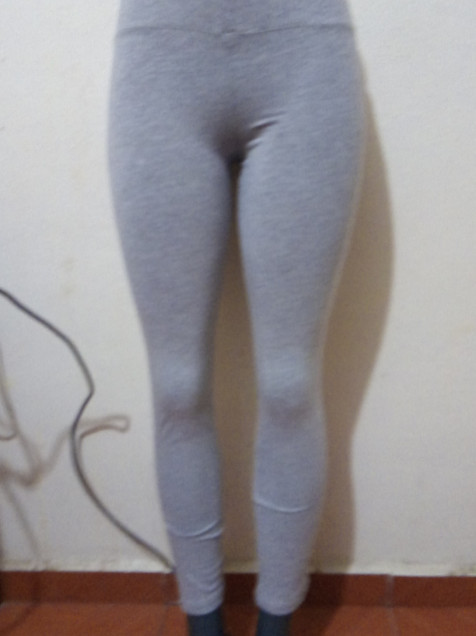
At what (x,y) coordinates should I click in order to perform the action: click on brown colored tiles. Please return your answer as a coordinate pair (x, y). Looking at the image, I should click on (89, 614), (356, 617).